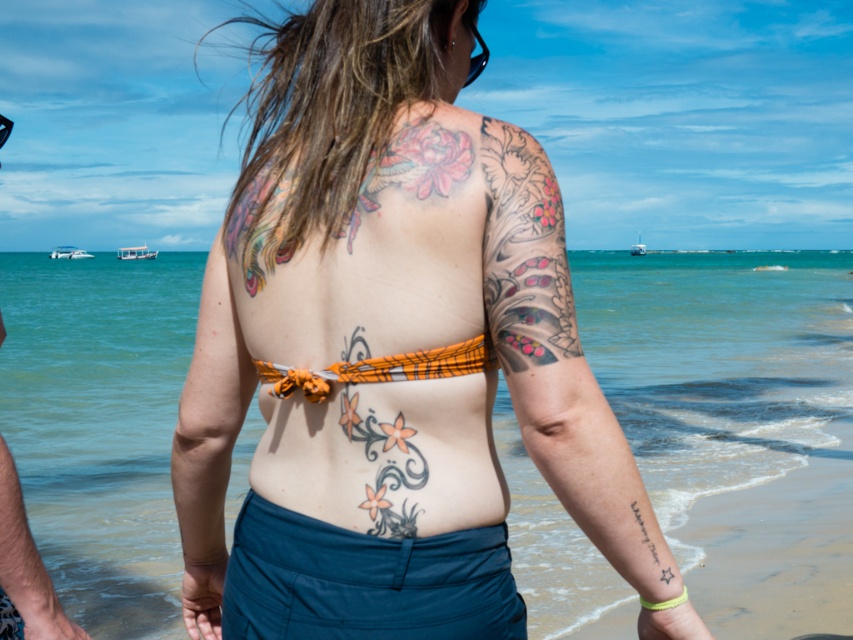
Question: Does orange fabric bikini top at center appear under smooth skin at left?

Choices:
 (A) yes
 (B) no

Answer: (B)

Question: Where is clear blue water at center located in relation to smooth skin at left in the image?

Choices:
 (A) right
 (B) left

Answer: (A)

Question: Among these points, which one is farthest from the camera?

Choices:
 (A) (654, 545)
 (B) (73, 634)
 (C) (486, 616)
 (D) (639, 380)

Answer: (D)

Question: Observing the image, what is the correct spatial positioning of smooth skin at left in reference to black ink star at lower right?

Choices:
 (A) above
 (B) below

Answer: (B)

Question: Among these objects, which one is nearest to the camera?

Choices:
 (A) black ink star at lower right
 (B) orange fabric bikini top at center
 (C) clear blue water at center
 (D) smooth skin at left

Answer: (B)

Question: Which object is closer to the camera taking this photo?

Choices:
 (A) smooth skin at left
 (B) black ink star at lower right
 (C) clear blue water at center

Answer: (B)